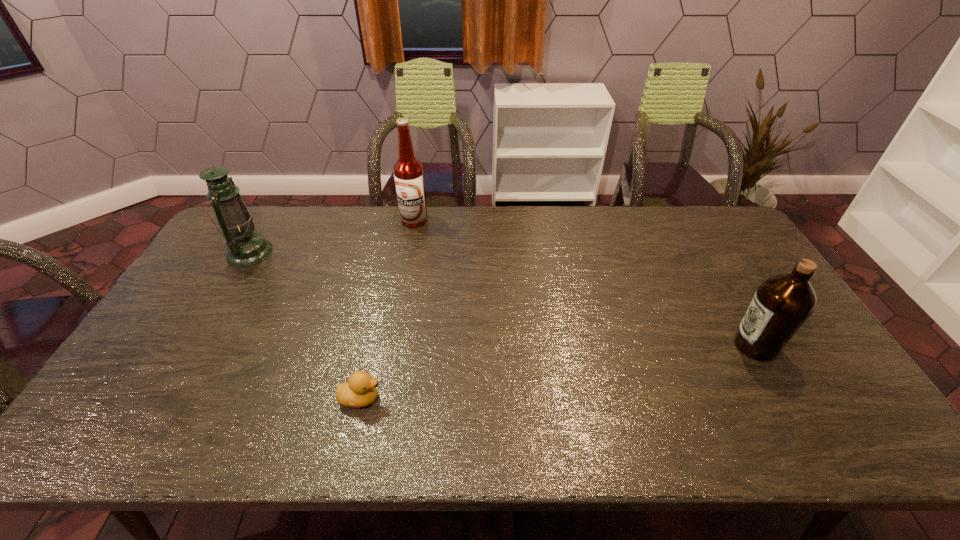
You are a GUI agent. You are given a task and a screenshot of the screen. Output one action in this format:
    pyautogui.click(x=<x>, y=<y>)
    Task: Click on the farthest object
    The height and width of the screenshot is (540, 960).
    Given the screenshot: What is the action you would take?
    pyautogui.click(x=408, y=171)

At what (x,y) coordinates should I click in order to perform the action: click on the leftmost object. Please return your answer as a coordinate pair (x, y). The height and width of the screenshot is (540, 960). Looking at the image, I should click on (245, 248).

Where is `the third nearest object`? Image resolution: width=960 pixels, height=540 pixels. the third nearest object is located at coordinates (245, 248).

The width and height of the screenshot is (960, 540). Find the location of `the rightmost object`. the rightmost object is located at coordinates (782, 303).

Image resolution: width=960 pixels, height=540 pixels. What are the coordinates of `olive oil` in the screenshot? It's located at (782, 303).

Image resolution: width=960 pixels, height=540 pixels. Identify the location of the nearest object. (360, 390).

Image resolution: width=960 pixels, height=540 pixels. In order to click on duckling in this screenshot , I will do `click(360, 390)`.

Find the location of a particular element. vacant space situated on the label side of the alcohol is located at coordinates (405, 272).

I want to click on vacant space located 0.120m on the back of the leftmost object, so click(271, 217).

Find the location of a particular element. vacant space located 0.250m on the label of the rightmost object is located at coordinates (639, 345).